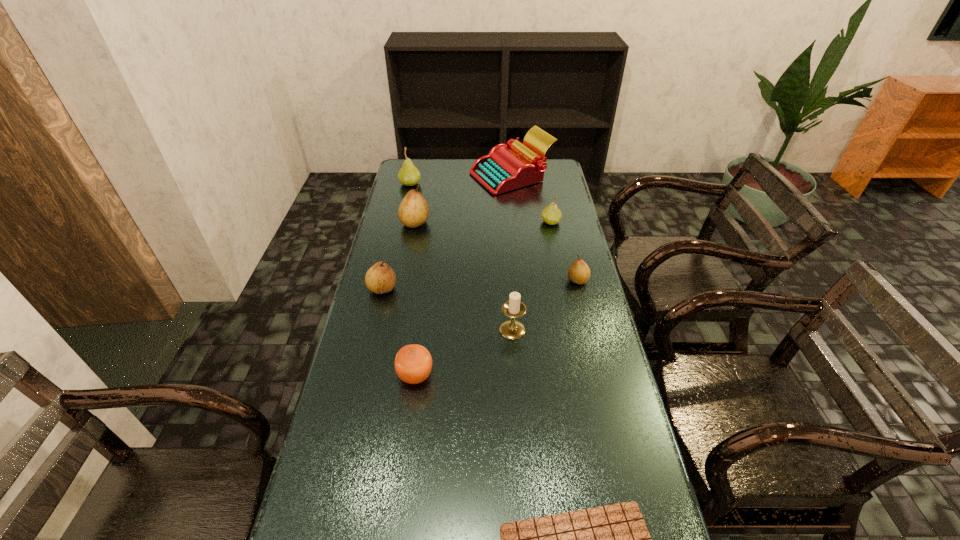
At what (x,y) coordinates should I click in order to perform the action: click on vacant position at the left edge of the desktop. Please return your answer as a coordinate pair (x, y). This screenshot has height=540, width=960. Looking at the image, I should click on (379, 384).

Image resolution: width=960 pixels, height=540 pixels. What are the coordinates of `vacant region at the right edge of the desktop` in the screenshot? It's located at (542, 237).

In the image, there is a desktop. Find the location of `vacant space at the far right corner`. vacant space at the far right corner is located at coordinates (551, 176).

In order to click on free space between the farthest brown pear and the orange in this screenshot , I will do `click(415, 299)`.

You are a GUI agent. You are given a task and a screenshot of the screen. Output one action in this format:
    pyautogui.click(x=<x>, y=<y>)
    Task: Click on the free space between the candle holder and the eighth farthest object
    The height and width of the screenshot is (540, 960).
    Given the screenshot: What is the action you would take?
    pyautogui.click(x=464, y=353)

This screenshot has height=540, width=960. I want to click on vacant area between the orange and the farther green pear, so click(413, 280).

This screenshot has width=960, height=540. Identify the location of vacant area that lies between the candle holder and the bigger green pear. (461, 256).

At what (x,y) coordinates should I click in order to perform the action: click on empty location between the farthest brown pear and the shortest pear. Please return your answer as a coordinate pair (x, y). Looking at the image, I should click on (496, 252).

Find the location of a particular element. The height and width of the screenshot is (540, 960). free space between the smaller green pear and the left green pear is located at coordinates (480, 202).

The image size is (960, 540). Identify the location of object that stands as the third closest to the nearer green pear. (413, 211).